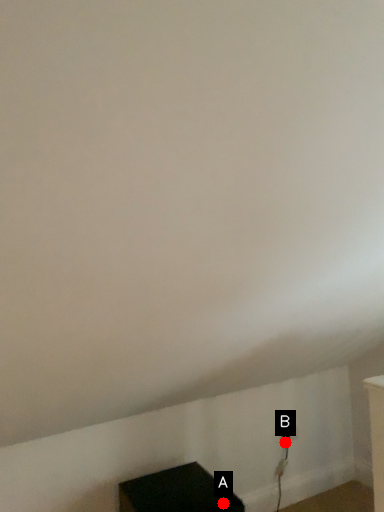
Question: Two points are circled on the image, labeled by A and B beside each circle. Which of the following is the closest to the observer?

Choices:
 (A) A is closer
 (B) B is closer

Answer: (A)